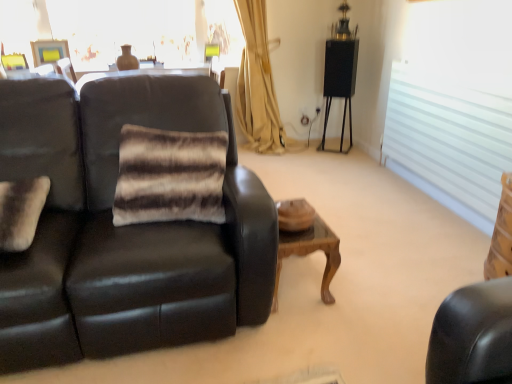
Question: Can you confirm if white frosted glass window at right, the 1th window positioned from the right, is bigger than brown striped fur pillow at center, arranged as the first pillow when viewed from the right?

Choices:
 (A) yes
 (B) no

Answer: (A)

Question: From the image's perspective, does white frosted glass window at right, placed as the 1th window when sorted from front to back, appear lower than brown striped fur pillow at center, the 2th pillow from the left?

Choices:
 (A) yes
 (B) no

Answer: (B)

Question: Does white frosted glass window at right, placed as the 1th window when sorted from front to back, turn towards brown striped fur pillow at center, arranged as the first pillow when viewed from the right?

Choices:
 (A) no
 (B) yes

Answer: (B)

Question: Is white frosted glass window at right, placed as the 1th window when sorted from front to back, closer to the viewer compared to brown striped fur pillow at center, arranged as the first pillow when viewed from the right?

Choices:
 (A) yes
 (B) no

Answer: (B)

Question: Does white frosted glass window at right, which is the 1th window from bottom to top, have a lesser height compared to brown striped fur pillow at center, arranged as the first pillow when viewed from the right?

Choices:
 (A) no
 (B) yes

Answer: (A)

Question: Do you think matte black couch at left is within translucent glass window at upper center, marked as the second window in a bottom-to-top arrangement, or outside of it?

Choices:
 (A) inside
 (B) outside

Answer: (B)

Question: Considering the positions of point (61, 188) and point (161, 41), is point (61, 188) closer or farther from the camera than point (161, 41)?

Choices:
 (A) closer
 (B) farther

Answer: (A)

Question: Looking at the image, does matte black couch at left seem bigger or smaller compared to translucent glass window at upper center, marked as the second window in a bottom-to-top arrangement?

Choices:
 (A) small
 (B) big

Answer: (B)

Question: Is matte black couch at left in front of or behind translucent glass window at upper center, positioned as the 1th window in top-to-bottom order, in the image?

Choices:
 (A) front
 (B) behind

Answer: (A)

Question: From the image's perspective, is white frosted glass window at right, placed as the 1th window when sorted from front to back, located above or below fuzzy white pillow at left, which is the 1th pillow from left to right?

Choices:
 (A) above
 (B) below

Answer: (A)

Question: In terms of size, does white frosted glass window at right, placed as the 1th window when sorted from front to back, appear bigger or smaller than fuzzy white pillow at left, which is the 1th pillow from left to right?

Choices:
 (A) big
 (B) small

Answer: (A)

Question: In terms of width, does white frosted glass window at right, the second window when ordered from top to bottom, look wider or thinner when compared to fuzzy white pillow at left, which is the 1th pillow from left to right?

Choices:
 (A) wide
 (B) thin

Answer: (B)

Question: Would you say white frosted glass window at right, which ranks as the second window in left-to-right order, is inside or outside fuzzy white pillow at left, which is the 1th pillow from left to right?

Choices:
 (A) outside
 (B) inside

Answer: (A)

Question: Choose the correct answer: Is brown striped fur pillow at center, arranged as the first pillow when viewed from the right, inside white frosted glass window at right, which ranks as the second window in left-to-right order, or outside it?

Choices:
 (A) inside
 (B) outside

Answer: (B)

Question: From the image's perspective, is brown striped fur pillow at center, arranged as the first pillow when viewed from the right, above or below white frosted glass window at right, placed as the 1th window when sorted from front to back?

Choices:
 (A) below
 (B) above

Answer: (A)